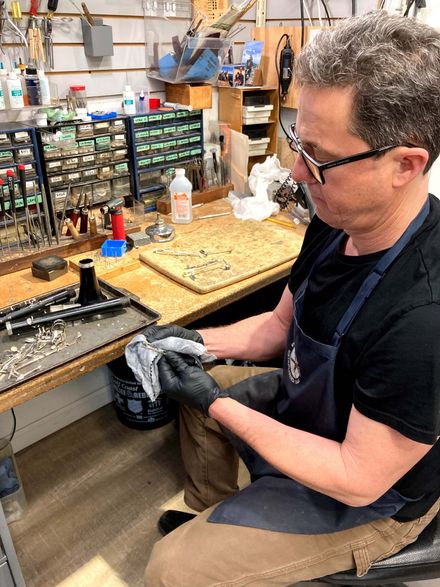
Identify the location of wall. The image size is (440, 587). point(134,67).